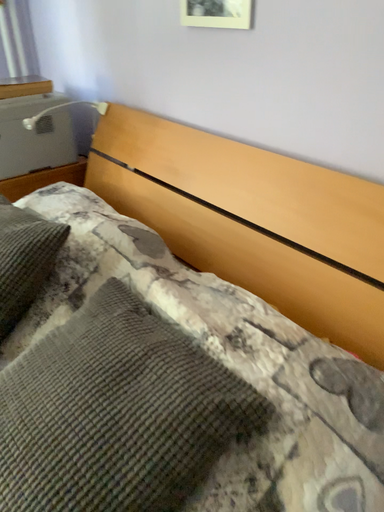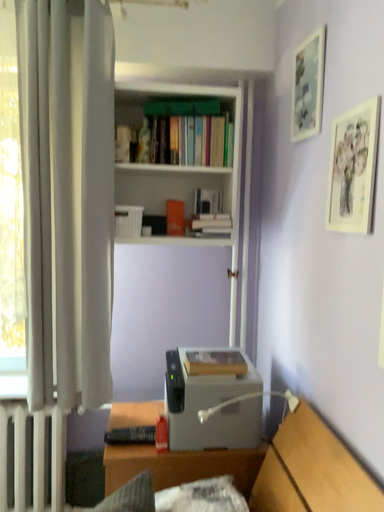
Question: How did the camera likely rotate when shooting the video?

Choices:
 (A) rotated upward
 (B) rotated downward

Answer: (A)